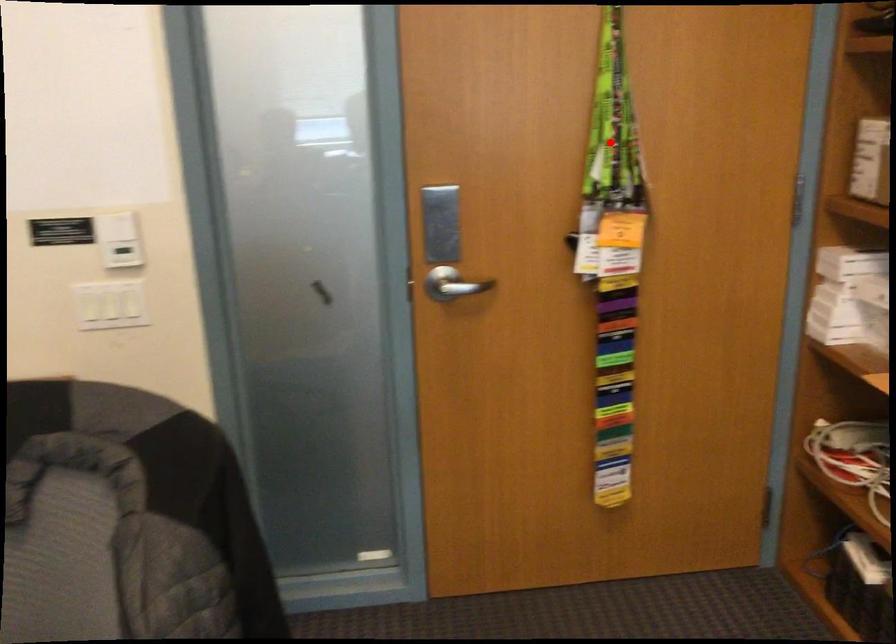
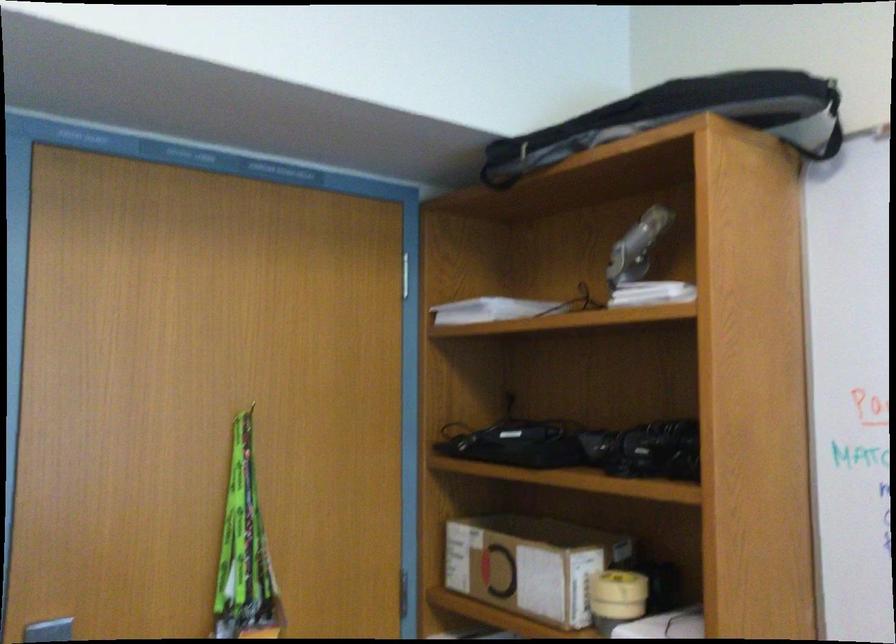
Locate, in the second image, the point that corresponds to the highlighted location in the first image.

(244, 547)